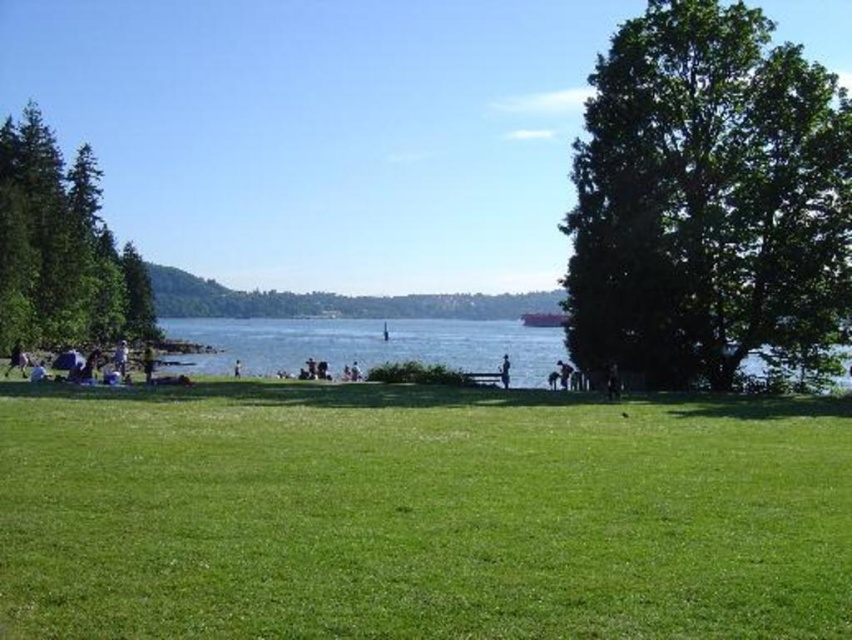
You are planning to set up a tent in the green grassy area. The tent requires a space that is taller than the yellow fabric person at lower left. Is the green textured tree at left suitable for this requirement?

The green textured tree at left is much taller than the yellow fabric person at lower left, so it meets the height requirement for setting up the tent.

You are standing at the lakeside and want to take a photo of the green textured tree at left. If your camera has a maximum zoom range of 100 meters, will you be able to capture the tree clearly in your photo?

The green textured tree at left is 77.06 meters away from the camera. Since the camera can zoom up to 100 meters, you can capture the tree clearly within the maximum zoom range of 100 meters.

You are standing at the lakeside and see both the blue water at center and the dark blue jeans at center. Which object is positioned further to the left?

The blue water at center is positioned further to the left compared to the dark blue jeans at center.